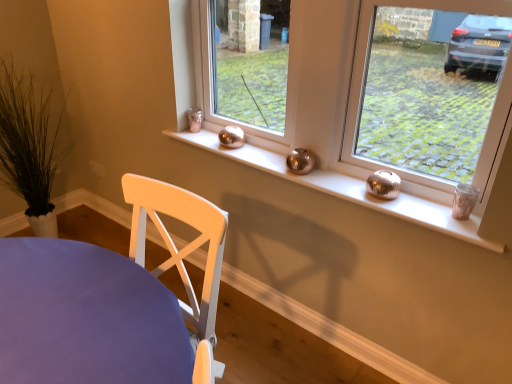
Question: Considering the relative positions of shiny metallic candle holder at right and metallic silver candle holder at right, arranged as the first window when viewed from the right, in the image provided, is shiny metallic candle holder at right to the left of metallic silver candle holder at right, arranged as the first window when viewed from the right, from the viewer's perspective?

Choices:
 (A) no
 (B) yes

Answer: (B)

Question: From a real-world perspective, is shiny metallic candle holder at right below metallic silver candle holder at right, arranged as the first window when viewed from the right?

Choices:
 (A) yes
 (B) no

Answer: (A)

Question: Can you confirm if shiny metallic candle holder at right is thinner than metallic silver candle holder at right, the 3th window from the left?

Choices:
 (A) yes
 (B) no

Answer: (B)

Question: From the image's perspective, is shiny metallic candle holder at right over metallic silver candle holder at right, arranged as the first window when viewed from the right?

Choices:
 (A) no
 (B) yes

Answer: (A)

Question: From a real-world perspective, is shiny metallic candle holder at right positioned over metallic silver candle holder at right, arranged as the first window when viewed from the right, based on gravity?

Choices:
 (A) no
 (B) yes

Answer: (A)

Question: Is shiny metallic candle holder at right located outside metallic silver candle holder at right, the 3th window from the left?

Choices:
 (A) no
 (B) yes

Answer: (B)

Question: From the image's perspective, is white painted wood chair at lower left above metallic silver vases at center, the second window when ordered from right to left?

Choices:
 (A) yes
 (B) no

Answer: (B)

Question: Is white painted wood chair at lower left at the left side of metallic silver vases at center, which is counted as the 2th window, starting from the left?

Choices:
 (A) no
 (B) yes

Answer: (B)

Question: From a real-world perspective, is white painted wood chair at lower left on metallic silver vases at center, the second window when ordered from right to left?

Choices:
 (A) yes
 (B) no

Answer: (B)

Question: Can you confirm if white painted wood chair at lower left is thinner than metallic silver vases at center, the second window when ordered from right to left?

Choices:
 (A) yes
 (B) no

Answer: (B)

Question: Is metallic silver vases at center, the second window when ordered from right to left, at the back of white painted wood chair at lower left?

Choices:
 (A) yes
 (B) no

Answer: (A)

Question: Considering the relative positions of white painted wood chair at lower left and metallic silver vases at center, which is counted as the 2th window, starting from the left, in the image provided, is white painted wood chair at lower left to the right of metallic silver vases at center, which is counted as the 2th window, starting from the left, from the viewer's perspective?

Choices:
 (A) yes
 (B) no

Answer: (B)

Question: Is shiny metallic candle holder at right taller than white painted wood chair at lower left?

Choices:
 (A) yes
 (B) no

Answer: (B)